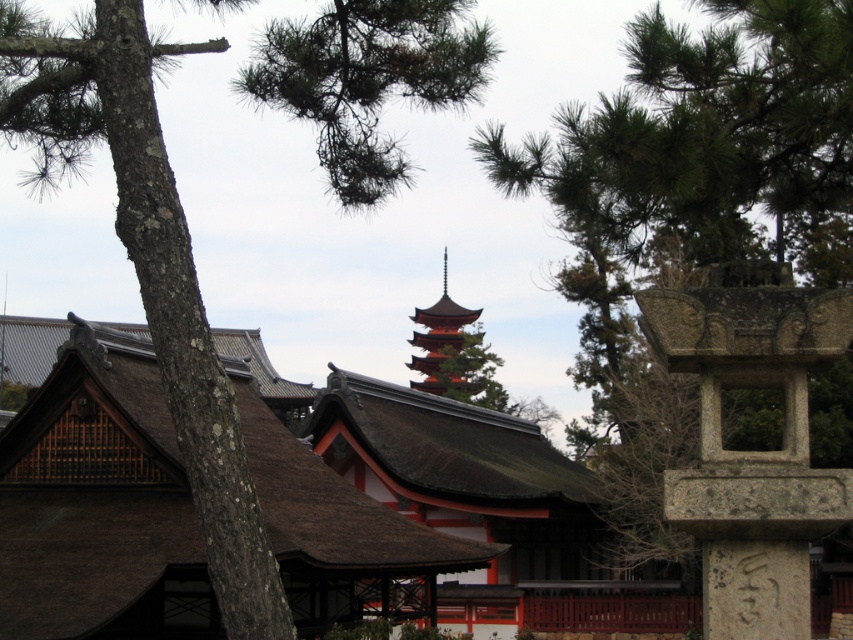
You are an architect visiting a Japanese temple and notice the gray stone lantern at right and the red lacquered pagoda at center. Which structure would require more materials to construct based on their sizes?

The red lacquered pagoda at center requires more materials to construct because it is larger than the gray stone lantern at right.